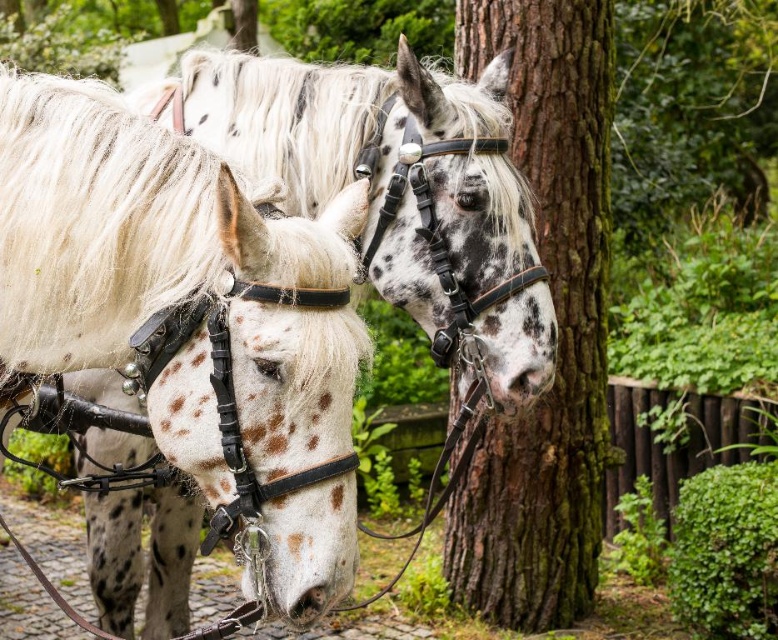
You are a photographer trying to capture both the speckled leather horse at center and the white silky mane at left in a single frame. Given that your camera has a minimum focus distance of 30 inches, will you be able to focus on both subjects simultaneously?

The speckled leather horse at center and white silky mane at left are 32.73 inches apart. Since the distance between them is greater than the camera minimum focus distance of 30 inches, you can focus on both subjects simultaneously.

You are a photographer trying to capture both the brown rough bark tree at center and the white silky mane at left in a single shot. Which object should you focus on first to ensure both are in frame?

The brown rough bark tree at center is further to the viewer than the white silky mane at left, so you should focus on the brown rough bark tree at center first to ensure both are in frame.

You are a painter setting up an easel to paint the speckled leather horse at center and the brown rough bark tree at center. Which subject should you choose if you want to paint something closer to your current position?

The speckled leather horse at center is smaller than the brown rough bark tree at center, so if you want to paint something closer, you should choose the speckled leather horse at center because smaller objects in the foreground appear closer than larger ones in the background.